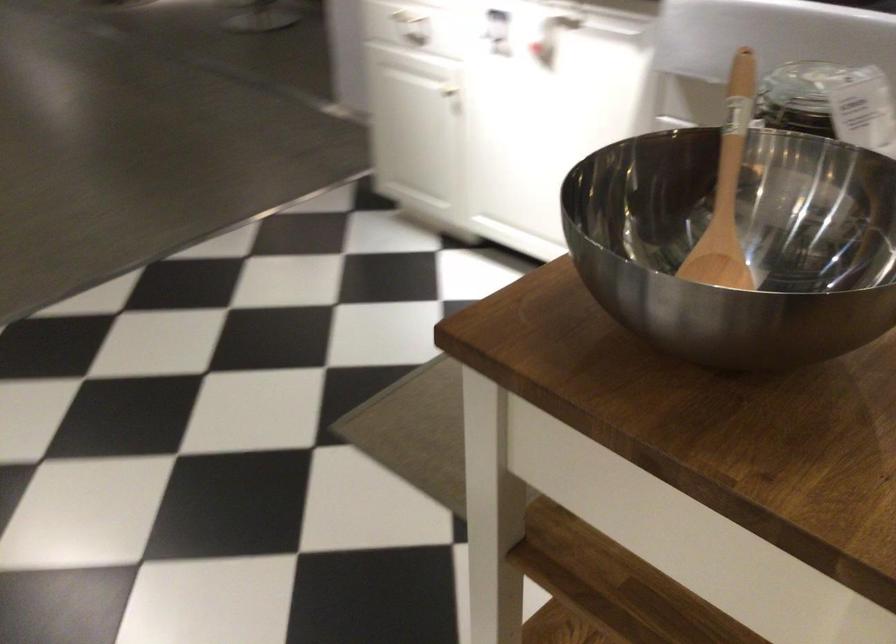
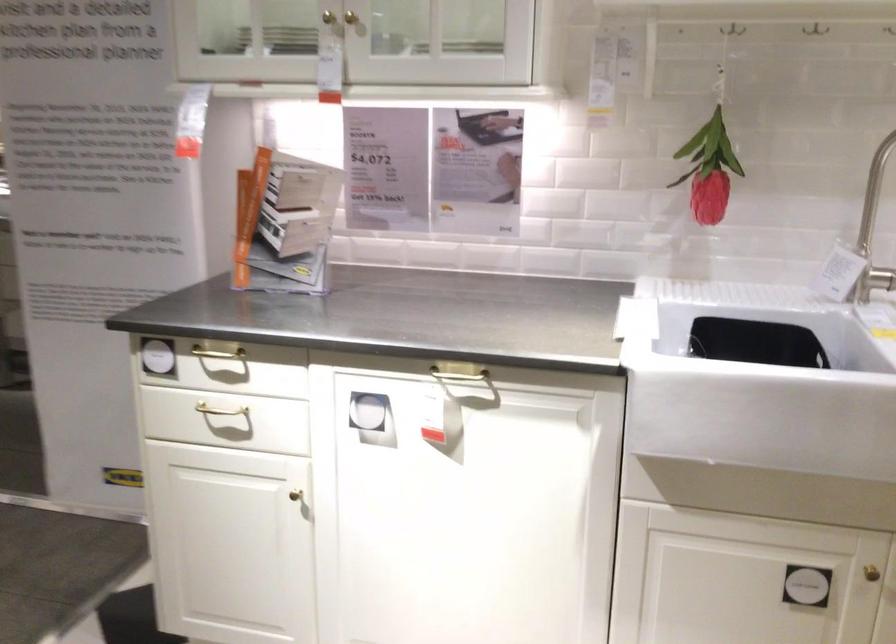
The images are taken continuously from a first-person perspective. In which direction is your viewpoint rotating?

The rotation direction of the camera is right-up.